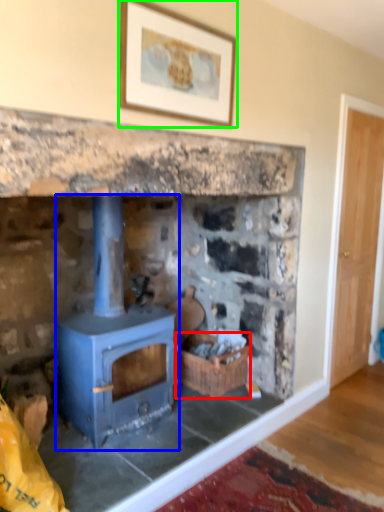
Question: Which object is positioned closest to basket (highlighted by a red box)? Select from wood burning stove (highlighted by a blue box) and picture frame (highlighted by a green box).

Choices:
 (A) wood burning stove
 (B) picture frame

Answer: (A)